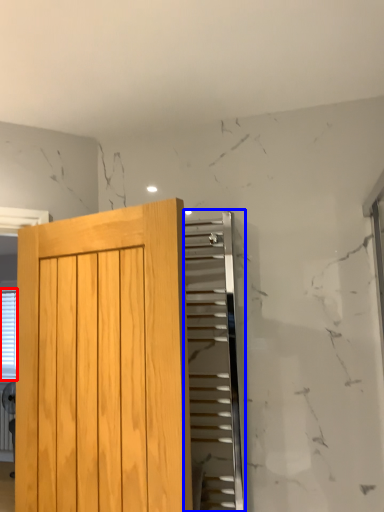
Question: Which object is closer to the camera taking this photo, blind (highlighted by a red box) or elevator (highlighted by a blue box)?

Choices:
 (A) blind
 (B) elevator

Answer: (B)